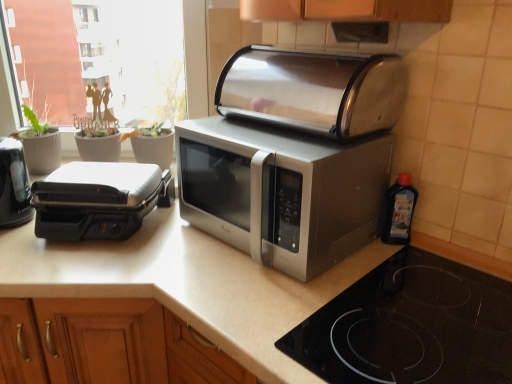
The image size is (512, 384). What do you see at coordinates (314, 90) in the screenshot?
I see `stainless steel toaster at center, the 3th toaster viewed from the left` at bounding box center [314, 90].

At what (x,y) coordinates should I click in order to perform the action: click on black plastic toaster at left, marked as the 1th toaster in a left-to-right arrangement. Please return your answer as a coordinate pair (x, y). This screenshot has height=384, width=512. Looking at the image, I should click on (14, 185).

Identify the location of satin silver microwave at center. (282, 191).

Who is shorter, black plastic toaster at left, which ranks as the 3th toaster in right-to-left order, or transparent plastic bottle at right?

With less height is transparent plastic bottle at right.

Does black plastic toaster at left, which ranks as the 3th toaster in right-to-left order, lie behind transparent plastic bottle at right?

Yes, black plastic toaster at left, which ranks as the 3th toaster in right-to-left order, is further from the viewer.

Is the depth of transparent plastic window screen at upper left greater than that of white matte countertop at center?

Yes, transparent plastic window screen at upper left is further from the camera.

Can you confirm if transparent plastic window screen at upper left is wider than white matte countertop at center?

In fact, transparent plastic window screen at upper left might be narrower than white matte countertop at center.

Considering the positions of objects transparent plastic window screen at upper left and white matte countertop at center in the image provided, who is more to the left, transparent plastic window screen at upper left or white matte countertop at center?

From the viewer's perspective, transparent plastic window screen at upper left appears more on the left side.

From the image's perspective, would you say transparent plastic window screen at upper left is shown under white matte countertop at center?

No, from the image's perspective, transparent plastic window screen at upper left is not beneath white matte countertop at center.

What's the angular difference between white matte countertop at center and black plastic toaster at left, marked as the 1th toaster in a left-to-right arrangement,'s facing directions?

44 degrees.

Is white matte countertop at center not near black plastic toaster at left, which ranks as the 3th toaster in right-to-left order?

Actually, white matte countertop at center and black plastic toaster at left, which ranks as the 3th toaster in right-to-left order, are a little close together.

From a real-world perspective, which object rests below the other?

From a 3D spatial view, white matte countertop at center is below.

Considering the sizes of objects white matte countertop at center and black plastic toaster at left, marked as the 1th toaster in a left-to-right arrangement, in the image provided, who is taller, white matte countertop at center or black plastic toaster at left, marked as the 1th toaster in a left-to-right arrangement,?

white matte countertop at center.

Would you say black plastic toaster at left, marked as the 1th toaster in a left-to-right arrangement, is inside or outside white matte countertop at center?

black plastic toaster at left, marked as the 1th toaster in a left-to-right arrangement, lies outside white matte countertop at center.

Is the position of black plastic toaster at left, which ranks as the 3th toaster in right-to-left order, less distant than that of white matte countertop at center?

No, it is behind white matte countertop at center.

Is satin silver microwave at center in front of black plastic toaster at left, marked as the 1th toaster in a left-to-right arrangement?

Yes, satin silver microwave at center is in front of black plastic toaster at left, marked as the 1th toaster in a left-to-right arrangement.

Considering the sizes of objects satin silver microwave at center and black plastic toaster at left, which ranks as the 3th toaster in right-to-left order, in the image provided, who is bigger, satin silver microwave at center or black plastic toaster at left, which ranks as the 3th toaster in right-to-left order,?

Bigger between the two is satin silver microwave at center.

Do you think satin silver microwave at center is within black plastic toaster at left, which ranks as the 3th toaster in right-to-left order, or outside of it?

satin silver microwave at center is spatially situated outside black plastic toaster at left, which ranks as the 3th toaster in right-to-left order.

Is satin silver microwave at center touching black plastic toaster at left, which ranks as the 3th toaster in right-to-left order?

No.

Is black glass cooktop at lower right positioned with its back to black plastic toaster at left, which is the 2th toaster in left-to-right order?

No.

Identify the location of gas stove below the black plastic toaster at left, which appears as the 2th toaster when viewed from the right (from the image's perspective). Image resolution: width=512 pixels, height=384 pixels. (411, 327).

Are black glass cooktop at lower right and black plastic toaster at left, which is the 2th toaster in left-to-right order, located far from each other?

No, black glass cooktop at lower right is in close proximity to black plastic toaster at left, which is the 2th toaster in left-to-right order.

Considering the positions of point (505, 285) and point (169, 200), is point (505, 285) closer or farther from the camera than point (169, 200)?

Point (505, 285) is positioned closer to the camera compared to point (169, 200).

Does black glass cooktop at lower right turn towards black plastic toaster at left, marked as the 1th toaster in a left-to-right arrangement?

No, black glass cooktop at lower right does not turn towards black plastic toaster at left, marked as the 1th toaster in a left-to-right arrangement.

From a real-world perspective, which is physically above, black glass cooktop at lower right or black plastic toaster at left, marked as the 1th toaster in a left-to-right arrangement?

black plastic toaster at left, marked as the 1th toaster in a left-to-right arrangement.

Which is closer to the camera, (472, 293) or (22, 207)?

Point (472, 293).

You are a GUI agent. You are given a task and a screenshot of the screen. Output one action in this format:
    pyautogui.click(x=<x>, y=<y>)
    Task: Click on the toaster that is the 3rd one when counting leftward from the transparent plastic bottle at right
    Image resolution: width=512 pixels, height=384 pixels.
    Given the screenshot: What is the action you would take?
    pyautogui.click(x=14, y=185)

You are a GUI agent. You are given a task and a screenshot of the screen. Output one action in this format:
    pyautogui.click(x=<x>, y=<y>)
    Task: Click on the countertop lying in front of the transparent plastic window screen at upper left
    
    Given the screenshot: What is the action you would take?
    pyautogui.click(x=186, y=284)

When comparing their distances from stainless steel toaster at center, the first toaster positioned from the right, does satin silver microwave at center or black glass cooktop at lower right seem closer?

satin silver microwave at center is positioned closer to the anchor stainless steel toaster at center, the first toaster positioned from the right.

Based on their spatial positions, is satin silver microwave at center or black plastic toaster at left, which ranks as the 3th toaster in right-to-left order, further from transparent plastic bottle at right?

black plastic toaster at left, which ranks as the 3th toaster in right-to-left order.

Based on their spatial positions, is transparent plastic bottle at right or white matte countertop at center closer to black glass cooktop at lower right?

white matte countertop at center is positioned closer to the anchor black glass cooktop at lower right.

From the image, which object appears to be nearer to black plastic toaster at left, which ranks as the 3th toaster in right-to-left order, black glass cooktop at lower right or satin silver microwave at center?

satin silver microwave at center lies closer to black plastic toaster at left, which ranks as the 3th toaster in right-to-left order, than the other object.

From the image, which object appears to be nearer to black plastic toaster at left, which ranks as the 3th toaster in right-to-left order, black glass cooktop at lower right or stainless steel toaster at center, the first toaster positioned from the right?

stainless steel toaster at center, the first toaster positioned from the right, is positioned closer to the anchor black plastic toaster at left, which ranks as the 3th toaster in right-to-left order.

Which object lies further to the anchor point transparent plastic bottle at right, white matte countertop at center or black plastic toaster at left, which is the 2th toaster in left-to-right order?

black plastic toaster at left, which is the 2th toaster in left-to-right order, is further to transparent plastic bottle at right.

Looking at the image, which one is located further to stainless steel toaster at center, the 3th toaster viewed from the left, black plastic toaster at left, which is the 2th toaster in left-to-right order, or transparent plastic bottle at right?

Based on the image, black plastic toaster at left, which is the 2th toaster in left-to-right order, appears to be further to stainless steel toaster at center, the 3th toaster viewed from the left.

From the image, which object appears to be farther from satin silver microwave at center, black glass cooktop at lower right or black plastic toaster at left, marked as the 1th toaster in a left-to-right arrangement?

black plastic toaster at left, marked as the 1th toaster in a left-to-right arrangement.

You are a GUI agent. You are given a task and a screenshot of the screen. Output one action in this format:
    pyautogui.click(x=<x>, y=<y>)
    Task: Click on the gas stove between stainless steel toaster at center, the first toaster positioned from the right, and white matte countertop at center in the up-down direction
    This screenshot has width=512, height=384.
    Given the screenshot: What is the action you would take?
    pyautogui.click(x=411, y=327)

At what (x,y) coordinates should I click in order to perform the action: click on countertop situated between black plastic toaster at left, marked as the 1th toaster in a left-to-right arrangement, and transparent plastic bottle at right from left to right. Please return your answer as a coordinate pair (x, y). Looking at the image, I should click on (186, 284).

I want to click on gas stove between white matte countertop at center and transparent plastic bottle at right from front to back, so click(x=411, y=327).

This screenshot has width=512, height=384. Identify the location of microwave oven between stainless steel toaster at center, the 3th toaster viewed from the left, and black glass cooktop at lower right from top to bottom. (282, 191).